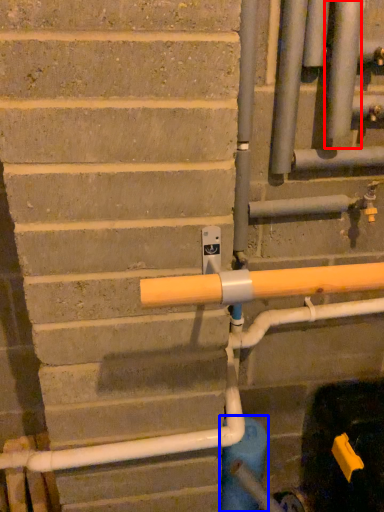
Question: Which of the following is the closest to the observer, pipe (highlighted by a red box) or water pipe (highlighted by a blue box)?

Choices:
 (A) pipe
 (B) water pipe

Answer: (A)